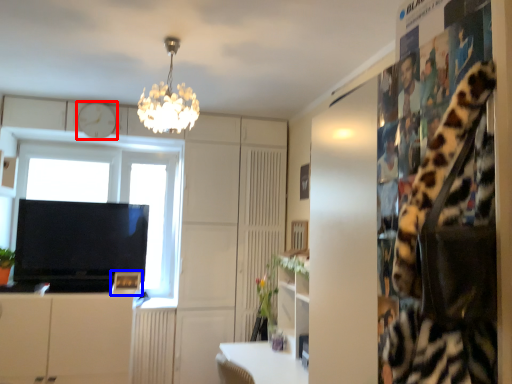
Question: Which point is closer to the camera, clock (highlighted by a red box) or picture frame (highlighted by a blue box)?

Choices:
 (A) clock
 (B) picture frame

Answer: (B)